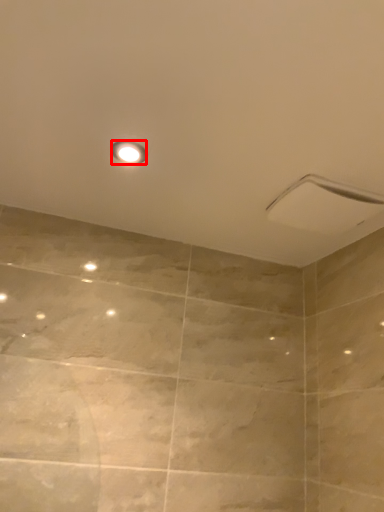
Question: Observing the image, what is the correct spatial positioning of light fixture (annotated by the red box) in reference to shower?

Choices:
 (A) left
 (B) right

Answer: (A)